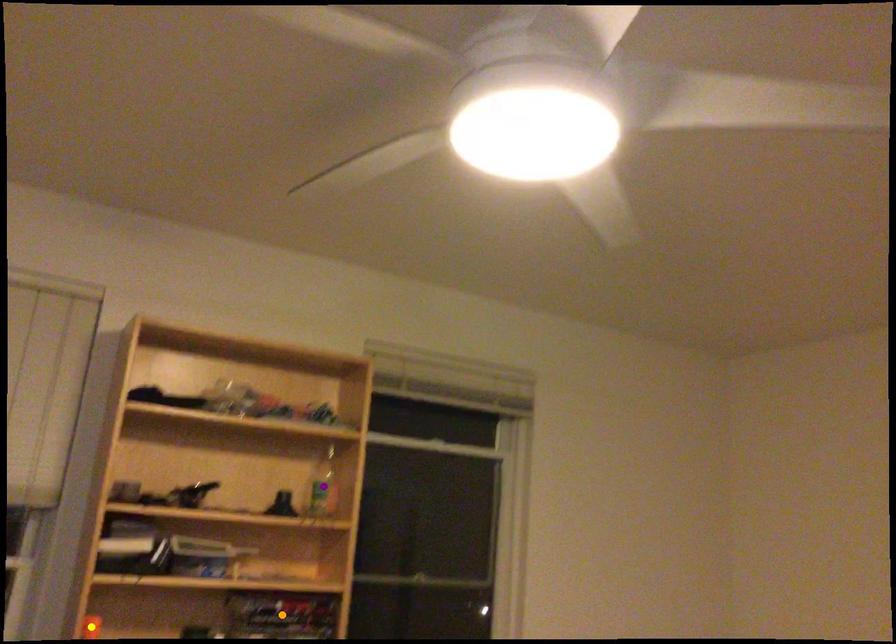
From the picture: Order these from nearest to farthest:
yellow point, purple point, orange point

yellow point, orange point, purple point